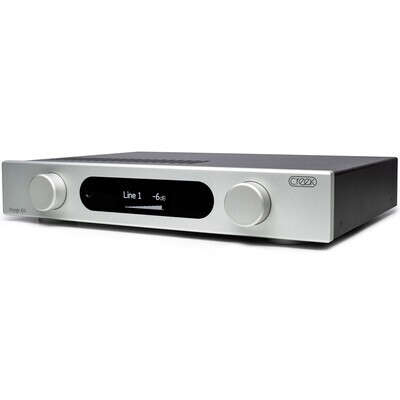
This screenshot has height=400, width=400. In order to click on black screen in this screenshot , I will do `click(104, 194)`.